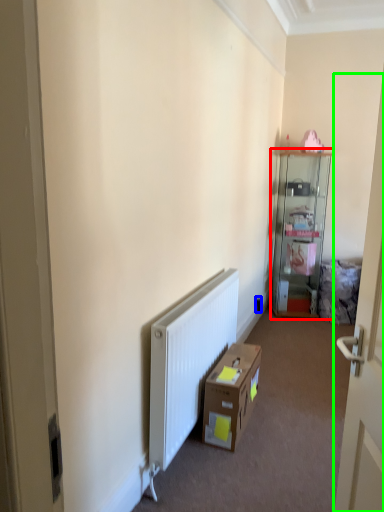
Question: Which is farther away from cabinetry (highlighted by a red box)? electric outlet (highlighted by a blue box) or door (highlighted by a green box)?

Choices:
 (A) electric outlet
 (B) door

Answer: (B)